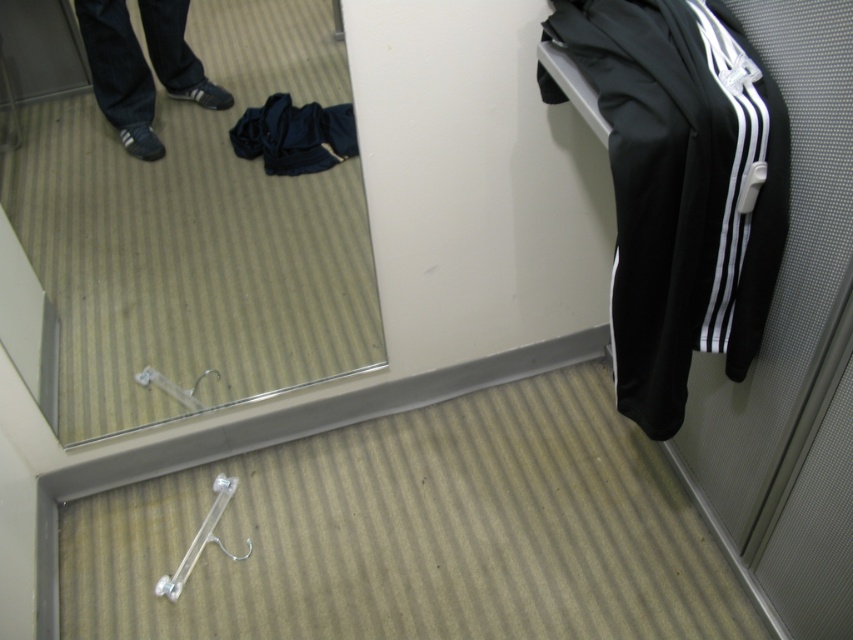
Is black fabric tracksuit at right to the left of dark blue jeans at lower left from the viewer's perspective?

No, black fabric tracksuit at right is not to the left of dark blue jeans at lower left.

Between point (735, 205) and point (109, 120), which one is positioned in front?

Point (735, 205) is in front.

Does point (715, 116) come farther from viewer compared to point (140, 88)?

No, it is in front of (140, 88).

Find the location of a particular element. black fabric tracksuit at right is located at coordinates (682, 188).

Can you confirm if dark blue jeans at lower left is shorter than dark blue fabric at center?

No.

Can you confirm if dark blue jeans at lower left is taller than dark blue fabric at center?

Indeed, dark blue jeans at lower left has a greater height compared to dark blue fabric at center.

Which is in front, point (113, 106) or point (276, 108)?

Point (113, 106) is in front.

The width and height of the screenshot is (853, 640). I want to click on dark blue jeans at lower left, so click(x=119, y=74).

Can you confirm if black fabric tracksuit at right is wider than dark blue fabric at center?

Yes.

Can you confirm if black fabric tracksuit at right is taller than dark blue fabric at center?

Indeed, black fabric tracksuit at right has a greater height compared to dark blue fabric at center.

Measure the distance between black fabric tracksuit at right and camera.

black fabric tracksuit at right is 37.25 inches away from camera.

The height and width of the screenshot is (640, 853). I want to click on black fabric tracksuit at right, so click(x=682, y=188).